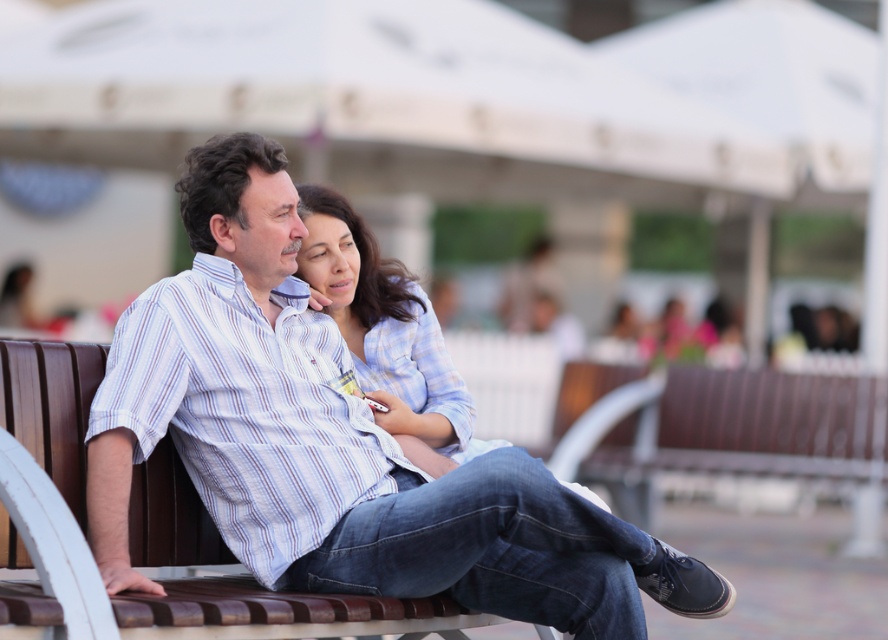
Is white striped shirt at center taller than brown wooden bench at lower right?

Indeed, white striped shirt at center has a greater height compared to brown wooden bench at lower right.

Locate an element on the screen. Image resolution: width=888 pixels, height=640 pixels. white striped shirt at center is located at coordinates click(337, 444).

Between point (278, 614) and point (406, 285), which one is positioned behind?

Positioned behind is point (406, 285).

Does brown wooden bench at center appear on the left side of blue plaid shirt at center?

Yes, brown wooden bench at center is to the left of blue plaid shirt at center.

You are a GUI agent. You are given a task and a screenshot of the screen. Output one action in this format:
    pyautogui.click(x=<x>, y=<y>)
    Task: Click on the brown wooden bench at center
    This screenshot has height=640, width=888.
    Given the screenshot: What is the action you would take?
    pyautogui.click(x=208, y=604)

This screenshot has height=640, width=888. What are the coordinates of `brown wooden bench at center` in the screenshot? It's located at (208, 604).

Between point (607, 449) and point (418, 428), which one is positioned behind?

Positioned behind is point (607, 449).

Find the location of a particular element. brown wooden bench at lower right is located at coordinates (754, 440).

Does point (690, 369) come closer to viewer compared to point (418, 388)?

No, (690, 369) is behind (418, 388).

Identify the location of brown wooden bench at lower right. The width and height of the screenshot is (888, 640). (754, 440).